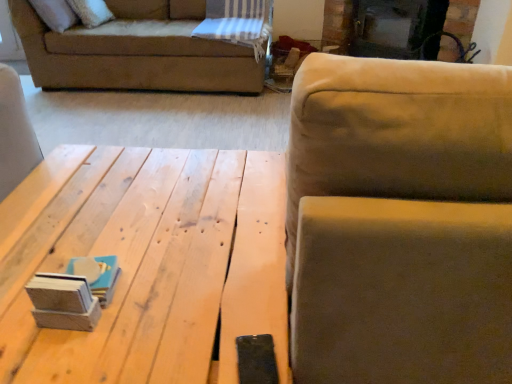
The image size is (512, 384). Describe the element at coordinates (400, 221) in the screenshot. I see `suede-like beige couch at upper right` at that location.

This screenshot has width=512, height=384. What are the coordinates of `black glass fireplace at upper center` in the screenshot? It's located at (338, 24).

From a real-world perspective, between natural wood table at center and suede-like beige couch at upper right, who is vertically lower?

natural wood table at center, from a real-world perspective.

The width and height of the screenshot is (512, 384). In the image, there is a suede-like beige couch at upper right. Find the location of `table below it (from a real-world perspective)`. table below it (from a real-world perspective) is located at coordinates (149, 263).

Considering the sizes of objects natural wood table at center and suede-like beige couch at upper right in the image provided, who is smaller, natural wood table at center or suede-like beige couch at upper right?

natural wood table at center.

Is natural wood table at center in front of suede-like beige couch at upper right?

No, it is not.

Which object is closer to the camera taking this photo, natural wood table at center or black glass fireplace at upper center?

Positioned in front is natural wood table at center.

Considering the sizes of objects natural wood table at center and black glass fireplace at upper center in the image provided, who is shorter, natural wood table at center or black glass fireplace at upper center?

natural wood table at center.

From a real-world perspective, is natural wood table at center located higher than black glass fireplace at upper center?

No, from a real-world perspective, natural wood table at center is not on top of black glass fireplace at upper center.

Would you consider natural wood table at center to be distant from black glass fireplace at upper center?

Absolutely, natural wood table at center is distant from black glass fireplace at upper center.

Between suede-like beige couch at upper right and black glass fireplace at upper center, which one appears on the left side from the viewer's perspective?

From the viewer's perspective, suede-like beige couch at upper right appears more on the left side.

From the image's perspective, is suede-like beige couch at upper right below black glass fireplace at upper center?

Yes.

At what (x,y) coordinates should I click in order to perform the action: click on fireplace above the suede-like beige couch at upper right (from the image's perspective). Please return your answer as a coordinate pair (x, y). The height and width of the screenshot is (384, 512). Looking at the image, I should click on (338, 24).

Could you tell me if suede-like beige couch at upper right is facing black glass fireplace at upper center?

Yes, suede-like beige couch at upper right is facing black glass fireplace at upper center.

In the scene shown: From the image's perspective, who appears lower, suede-like beige couch at upper right or natural wood table at center?

natural wood table at center.

Is the position of suede-like beige couch at upper right more distant than that of natural wood table at center?

No, suede-like beige couch at upper right is closer to the camera.

Based on the photo, is suede-like beige couch at upper right far away from natural wood table at center?

They are positioned close to each other.

There is a natural wood table at center. Where is `studio couch above it (from a real-world perspective)`? The height and width of the screenshot is (384, 512). studio couch above it (from a real-world perspective) is located at coordinates (400, 221).

Which of these two, black glass fireplace at upper center or natural wood table at center, is thinner?

black glass fireplace at upper center.

From a real-world perspective, which object rests below the other?

From a 3D spatial view, natural wood table at center is below.

Does point (348, 42) come behind point (42, 354)?

Yes.

Does black glass fireplace at upper center come behind natural wood table at center?

That is True.

Is black glass fireplace at upper center smaller than suede-like beige couch at upper right?

Correct, black glass fireplace at upper center occupies less space than suede-like beige couch at upper right.

Is suede-like beige couch at upper right at the back of black glass fireplace at upper center?

That's not correct — black glass fireplace at upper center is not looking away from suede-like beige couch at upper right.

Would you say black glass fireplace at upper center is outside suede-like beige couch at upper right?

Yes.

I want to click on table behind the suede-like beige couch at upper right, so click(149, 263).

Identify the location of table on the left of black glass fireplace at upper center. This screenshot has height=384, width=512. (149, 263).

When comparing their distances from suede-like beige couch at upper right, does black glass fireplace at upper center or natural wood table at center seem closer?

natural wood table at center lies closer to suede-like beige couch at upper right than the other object.

Estimate the real-world distances between objects in this image. Which object is closer to natural wood table at center, suede-like beige couch at upper right or black glass fireplace at upper center?

suede-like beige couch at upper right is positioned closer to the anchor natural wood table at center.

Estimate the real-world distances between objects in this image. Which object is further from black glass fireplace at upper center, suede-like beige couch at upper right or natural wood table at center?

suede-like beige couch at upper right.

Looking at the image, which one is located further to natural wood table at center, black glass fireplace at upper center or suede-like beige couch at upper right?

black glass fireplace at upper center is positioned further to the anchor natural wood table at center.

Looking at this image, from the image, which object appears to be farther from suede-like beige couch at upper right, natural wood table at center or black glass fireplace at upper center?

Among the two, black glass fireplace at upper center is located further to suede-like beige couch at upper right.

From the image, which object appears to be farther from black glass fireplace at upper center, natural wood table at center or suede-like beige couch at upper right?

Based on the image, suede-like beige couch at upper right appears to be further to black glass fireplace at upper center.

What are the coordinates of `table positioned between suede-like beige couch at upper right and black glass fireplace at upper center from near to far` in the screenshot? It's located at (149, 263).